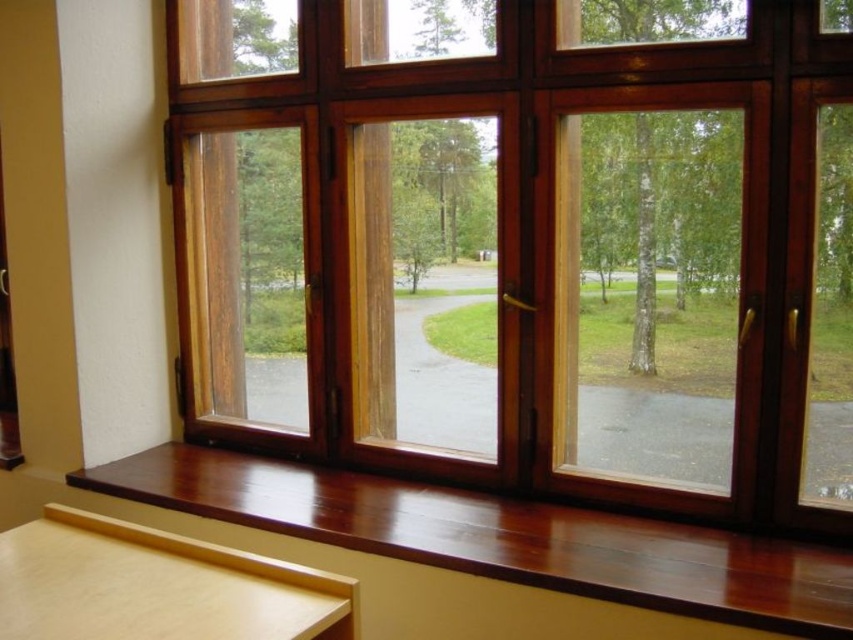
Does wooden bay window at center have a lesser height compared to mahogany wood window sill at lower center?

No.

Between point (495, 353) and point (413, 540), which one is positioned in front?

Point (413, 540) is in front.

Describe the element at coordinates (529, 246) in the screenshot. I see `wooden bay window at center` at that location.

The image size is (853, 640). What are the coordinates of `wooden bay window at center` in the screenshot? It's located at (529, 246).

Is wooden bay window at center smaller than green leafy tree at upper left?

No, wooden bay window at center is not smaller than green leafy tree at upper left.

I want to click on wooden bay window at center, so [x=529, y=246].

Between mahogany wood window sill at lower center and green leafy tree at upper left, which one appears on the right side from the viewer's perspective?

mahogany wood window sill at lower center is more to the right.

Does mahogany wood window sill at lower center have a greater width compared to green leafy tree at upper left?

Indeed, mahogany wood window sill at lower center has a greater width compared to green leafy tree at upper left.

Identify the location of mahogany wood window sill at lower center. This screenshot has height=640, width=853. (503, 538).